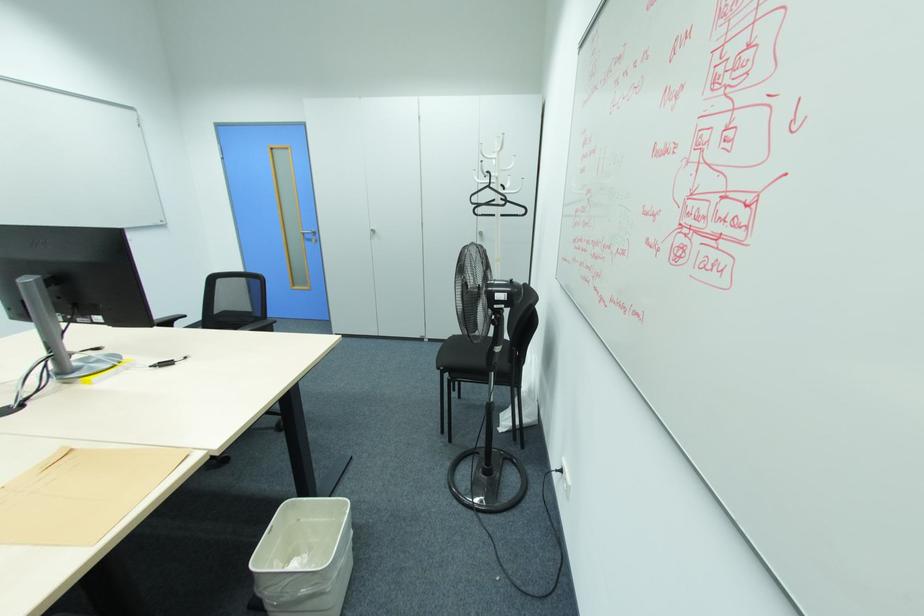
Where is `silver door handle`? The height and width of the screenshot is (616, 924). silver door handle is located at coordinates (310, 235).